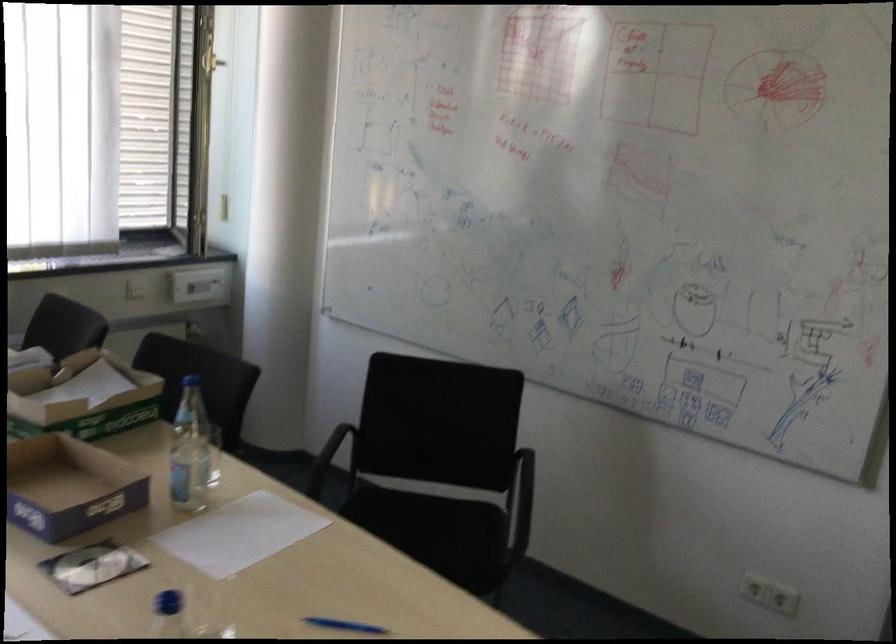
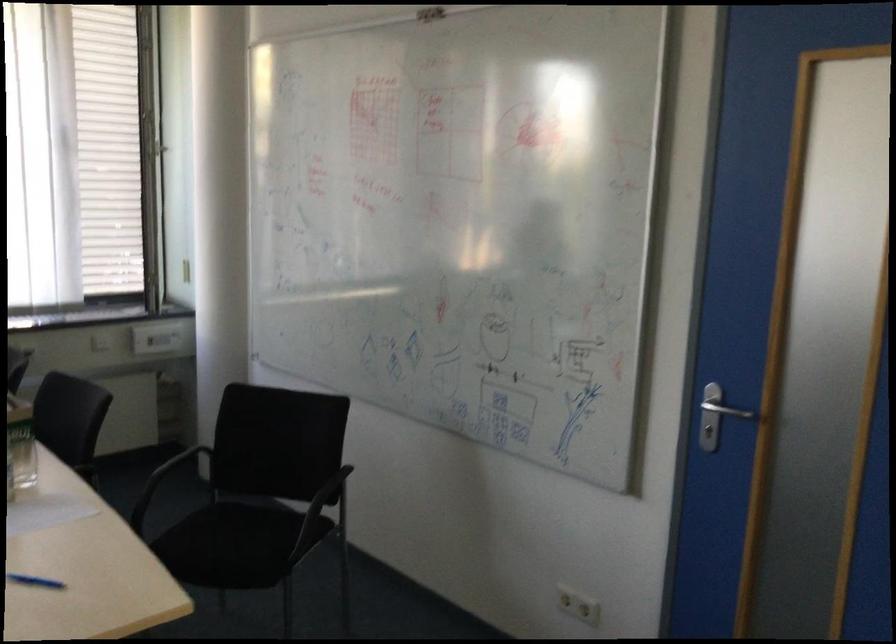
The point at (432, 524) is marked in the first image. Where is the corresponding point in the second image?

(251, 529)